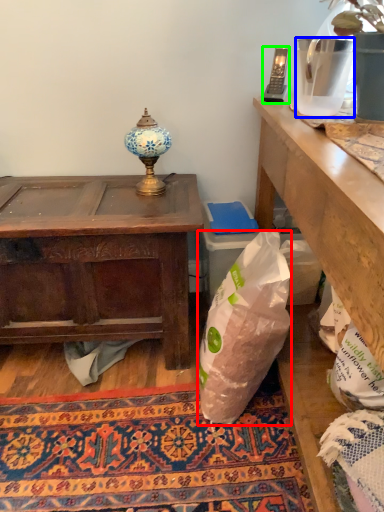
Question: Which is farther away from plastic bag (highlighted by a red box)? vase (highlighted by a blue box) or mobile phone (highlighted by a green box)?

Choices:
 (A) vase
 (B) mobile phone

Answer: (B)